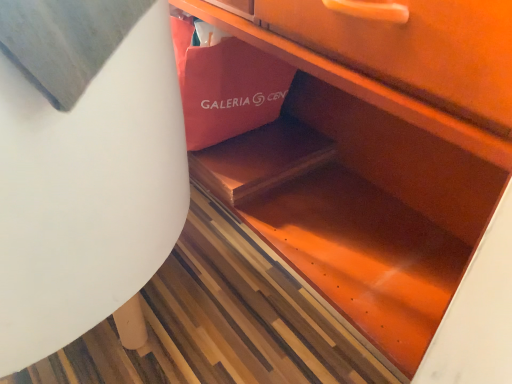
This screenshot has height=384, width=512. Describe the element at coordinates (86, 176) in the screenshot. I see `white matte round table at lower left` at that location.

This screenshot has height=384, width=512. I want to click on white matte round table at lower left, so click(x=86, y=176).

What is the approximate width of white matte round table at lower left?

white matte round table at lower left is 16.17 inches wide.

Describe the element at coordinates (225, 85) in the screenshot. I see `matte pink paper bag at center` at that location.

This screenshot has height=384, width=512. What are the coordinates of `matte pink paper bag at center` in the screenshot? It's located at (225, 85).

Locate an element on the screen. white matte round table at lower left is located at coordinates (86, 176).

Does white matte round table at lower left appear on the right side of matte pink paper bag at center?

In fact, white matte round table at lower left is to the left of matte pink paper bag at center.

Between white matte round table at lower left and matte pink paper bag at center, which one is positioned behind?

matte pink paper bag at center is further away from the camera.

Is point (49, 194) positioned before point (192, 21)?

Yes, point (49, 194) is closer to viewer.

From the picture: From the image's perspective, is white matte round table at lower left located above matte pink paper bag at center?

No, from the image's perspective, white matte round table at lower left is not on top of matte pink paper bag at center.

From a real-world perspective, is white matte round table at lower left positioned over matte pink paper bag at center based on gravity?

Yes, from a real-world perspective, white matte round table at lower left is above matte pink paper bag at center.

In terms of width, does white matte round table at lower left look wider or thinner when compared to matte pink paper bag at center?

Clearly, white matte round table at lower left has more width compared to matte pink paper bag at center.

Considering the relative sizes of white matte round table at lower left and matte pink paper bag at center in the image provided, is white matte round table at lower left taller than matte pink paper bag at center?

Correct, white matte round table at lower left is much taller as matte pink paper bag at center.

In the scene shown: Can you confirm if white matte round table at lower left is bigger than matte pink paper bag at center?

Yes, white matte round table at lower left is bigger than matte pink paper bag at center.

Is white matte round table at lower left inside or outside of matte pink paper bag at center?

white matte round table at lower left is not inside matte pink paper bag at center, it's outside.

Is white matte round table at lower left next to matte pink paper bag at center?

No, white matte round table at lower left is not touching matte pink paper bag at center.

Is white matte round table at lower left facing towards matte pink paper bag at center?

No, white matte round table at lower left is not turned towards matte pink paper bag at center.

At what (x,y) coordinates should I click in order to perform the action: click on shopping bag above the white matte round table at lower left (from the image's perspective). Please return your answer as a coordinate pair (x, y). Looking at the image, I should click on (225, 85).

Which object is positioned more to the left, matte pink paper bag at center or white matte round table at lower left?

Positioned to the left is white matte round table at lower left.

Which is behind, matte pink paper bag at center or white matte round table at lower left?

matte pink paper bag at center is more distant.

Is point (191, 27) in front of point (65, 307)?

No, (191, 27) is further to viewer.

From the image's perspective, relative to white matte round table at lower left, is matte pink paper bag at center above or below?

matte pink paper bag at center is situated higher than white matte round table at lower left in the image.

From a real-world perspective, is matte pink paper bag at center physically above white matte round table at lower left?

Incorrect, from a real-world perspective, matte pink paper bag at center is lower than white matte round table at lower left.

In the scene shown: Which of these two, matte pink paper bag at center or white matte round table at lower left, is wider?

With larger width is white matte round table at lower left.

Considering the sizes of matte pink paper bag at center and white matte round table at lower left in the image, is matte pink paper bag at center taller or shorter than white matte round table at lower left?

matte pink paper bag at center is shorter than white matte round table at lower left.

In the scene shown: Can you confirm if matte pink paper bag at center is bigger than white matte round table at lower left?

No.

Is matte pink paper bag at center outside of white matte round table at lower left?

Indeed, matte pink paper bag at center is completely outside white matte round table at lower left.

Would you consider matte pink paper bag at center to be distant from white matte round table at lower left?

That's not correct — matte pink paper bag at center is a little close to white matte round table at lower left.

Is matte pink paper bag at center oriented towards white matte round table at lower left?

Yes, matte pink paper bag at center is turned towards white matte round table at lower left.

Locate an element on the screen. This screenshot has width=512, height=384. round table on the left side of matte pink paper bag at center is located at coordinates (86, 176).

Locate an element on the screen. This screenshot has width=512, height=384. round table below the matte pink paper bag at center (from the image's perspective) is located at coordinates (86, 176).

Locate an element on the screen. The height and width of the screenshot is (384, 512). shopping bag above the white matte round table at lower left (from the image's perspective) is located at coordinates (225, 85).